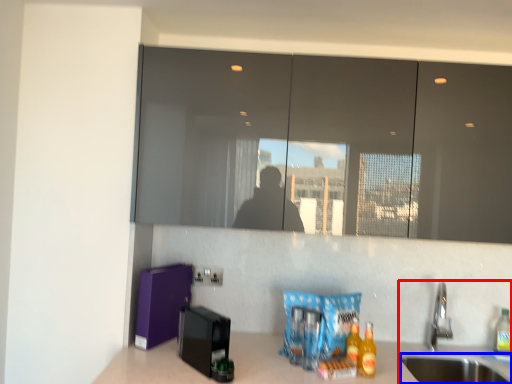
Question: Which object is further to the camera taking this photo, sink (highlighted by a red box) or sink (highlighted by a blue box)?

Choices:
 (A) sink
 (B) sink

Answer: (A)